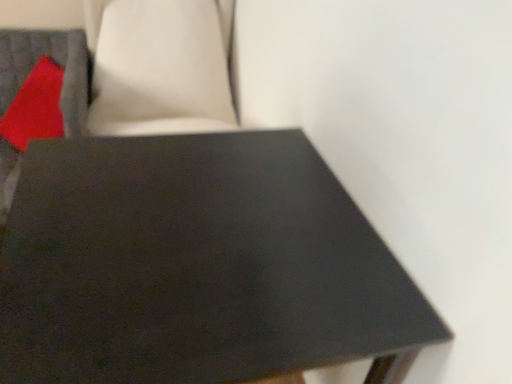
This screenshot has height=384, width=512. Describe the element at coordinates (195, 265) in the screenshot. I see `matte black table at center` at that location.

Find the location of a particular element. The image size is (512, 384). matte black table at center is located at coordinates (195, 265).

Where is `matte red pillow at upper left`? The image size is (512, 384). matte red pillow at upper left is located at coordinates (35, 107).

Describe the element at coordinates (35, 107) in the screenshot. I see `matte red pillow at upper left` at that location.

Measure the distance between point (x=2, y=136) and camera.

A distance of 3.69 feet exists between point (x=2, y=136) and camera.

Identify the location of matte black table at center. The height and width of the screenshot is (384, 512). (195, 265).

Which object is positioned more to the right, matte red pillow at upper left or matte black table at center?

matte black table at center.

Considering the relative positions of matte red pillow at upper left and matte black table at center in the image provided, is matte red pillow at upper left in front of matte black table at center?

No, matte red pillow at upper left is behind matte black table at center.

Does point (47, 135) come in front of point (185, 379)?

That is False.

From the image's perspective, which is below, matte red pillow at upper left or matte black table at center?

matte black table at center, from the image's perspective.

From a real-world perspective, is matte red pillow at upper left on matte black table at center?

Indeed, from a real-world perspective, matte red pillow at upper left stands above matte black table at center.

Can you confirm if matte red pillow at upper left is thinner than matte black table at center?

Correct, the width of matte red pillow at upper left is less than that of matte black table at center.

In terms of height, does matte red pillow at upper left look taller or shorter compared to matte black table at center?

matte red pillow at upper left is shorter than matte black table at center.

Can you confirm if matte red pillow at upper left is bigger than matte black table at center?

Incorrect, matte red pillow at upper left is not larger than matte black table at center.

Is matte red pillow at upper left not inside matte black table at center?

Indeed, matte red pillow at upper left is completely outside matte black table at center.

Are matte red pillow at upper left and matte black table at center far apart?

They are positioned close to each other.

Is matte red pillow at upper left aimed at matte black table at center?

Yes, matte red pillow at upper left is turned towards matte black table at center.

How many degrees apart are the facing directions of matte red pillow at upper left and matte black table at center?

88.8 degrees.

Identify the location of table directly beneath the matte red pillow at upper left (from a real-world perspective). Image resolution: width=512 pixels, height=384 pixels. (195, 265).

Does matte black table at center appear on the left side of matte red pillow at upper left?

No, matte black table at center is not to the left of matte red pillow at upper left.

Is matte black table at center in front of or behind matte red pillow at upper left in the image?

Visually, matte black table at center is located in front of matte red pillow at upper left.

Which point is more forward, (x=22, y=271) or (x=36, y=90)?

The point (x=22, y=271) is more forward.

From the image's perspective, is matte black table at center on top of matte red pillow at upper left?

Incorrect, from the image's perspective, matte black table at center is lower than matte red pillow at upper left.

From a real-world perspective, is matte black table at center over matte red pillow at upper left?

No.

Which object is thinner, matte black table at center or matte red pillow at upper left?

Thinner between the two is matte red pillow at upper left.

Which of these two, matte black table at center or matte red pillow at upper left, stands taller?

Standing taller between the two is matte black table at center.

Based on the photo, between matte black table at center and matte red pillow at upper left, which one has smaller size?

With smaller size is matte red pillow at upper left.

Could matte red pillow at upper left be considered to be inside matte black table at center?

No, matte red pillow at upper left is located outside of matte black table at center.

Is matte black table at center next to matte red pillow at upper left and touching it?

No, matte black table at center is not beside matte red pillow at upper left.

Could you tell me if matte black table at center is turned towards matte red pillow at upper left?

No, matte black table at center is not turned towards matte red pillow at upper left.

How many degrees apart are the facing directions of matte black table at center and matte red pillow at upper left?

The angle between the facing direction of matte black table at center and the facing direction of matte red pillow at upper left is 88.8 degrees.

What are the coordinates of `table below the matte red pillow at upper left (from a real-world perspective)` in the screenshot? It's located at (195, 265).

Identify the location of pillow above the matte black table at center (from the image's perspective). The width and height of the screenshot is (512, 384). tap(35, 107).

Identify the location of table in front of the matte red pillow at upper left. This screenshot has width=512, height=384. (195, 265).